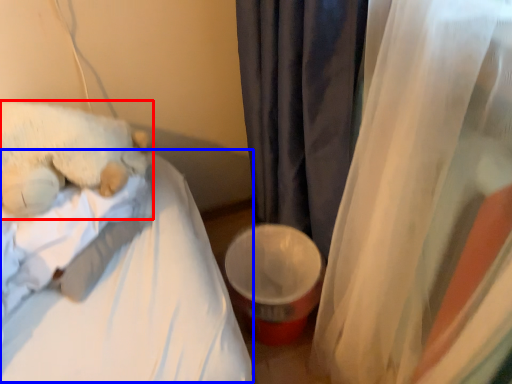
Question: Which point is further to the camera, teddy bear (highlighted by a red box) or mattress (highlighted by a blue box)?

Choices:
 (A) teddy bear
 (B) mattress

Answer: (A)